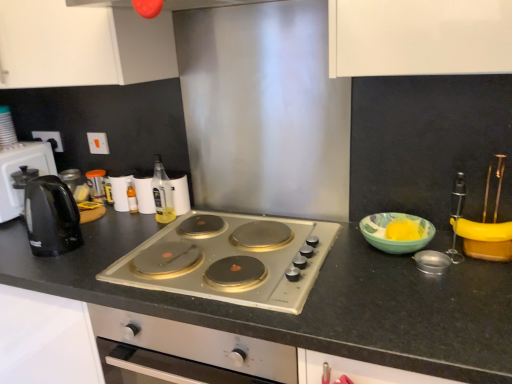
This screenshot has height=384, width=512. Find the location of `vacant area on top of black granite countertop at center (from a real-world perspective)`. vacant area on top of black granite countertop at center (from a real-world perspective) is located at coordinates (207, 240).